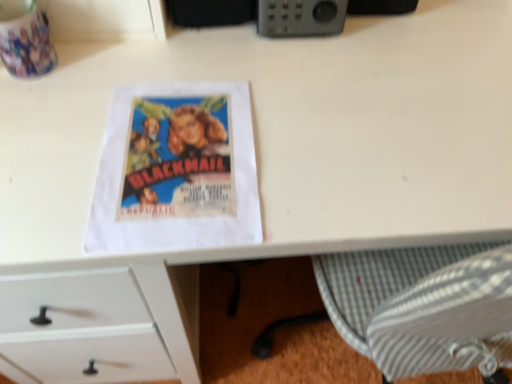
Question: Considering the relative sizes of gray plastic radio at upper center and matte paper poster at center in the image provided, is gray plastic radio at upper center shorter than matte paper poster at center?

Choices:
 (A) yes
 (B) no

Answer: (B)

Question: Can you confirm if gray plastic radio at upper center is bigger than matte paper poster at center?

Choices:
 (A) no
 (B) yes

Answer: (B)

Question: From the image's perspective, is gray plastic radio at upper center located above matte paper poster at center?

Choices:
 (A) yes
 (B) no

Answer: (A)

Question: Is gray plastic radio at upper center oriented away from matte paper poster at center?

Choices:
 (A) no
 (B) yes

Answer: (A)

Question: Is gray plastic radio at upper center not close to matte paper poster at center?

Choices:
 (A) no
 (B) yes

Answer: (A)

Question: Is gray plastic radio at upper center outside matte paper poster at center?

Choices:
 (A) yes
 (B) no

Answer: (A)

Question: Can you confirm if matte paper poster at center is smaller than gray plastic radio at upper center?

Choices:
 (A) no
 (B) yes

Answer: (B)

Question: Can you confirm if matte paper poster at center is positioned to the right of gray plastic radio at upper center?

Choices:
 (A) yes
 (B) no

Answer: (B)

Question: Can you confirm if matte paper poster at center is wider than gray plastic radio at upper center?

Choices:
 (A) yes
 (B) no

Answer: (A)

Question: Is matte paper poster at center next to gray plastic radio at upper center?

Choices:
 (A) yes
 (B) no

Answer: (B)

Question: Considering the relative sizes of matte paper poster at center and gray plastic radio at upper center in the image provided, is matte paper poster at center thinner than gray plastic radio at upper center?

Choices:
 (A) yes
 (B) no

Answer: (B)

Question: From the image's perspective, is matte paper poster at center beneath gray plastic radio at upper center?

Choices:
 (A) yes
 (B) no

Answer: (A)

Question: From a real-world perspective, is gray plastic radio at upper center positioned above or below matte paper poster at center?

Choices:
 (A) below
 (B) above

Answer: (B)